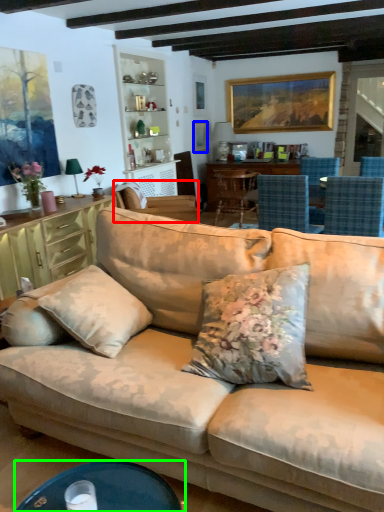
Question: Estimate the real-world distances between objects in this image. Which object is farther from chair (highlighted by a red box), picture frame (highlighted by a blue box) or desk (highlighted by a green box)?

Choices:
 (A) picture frame
 (B) desk

Answer: (B)